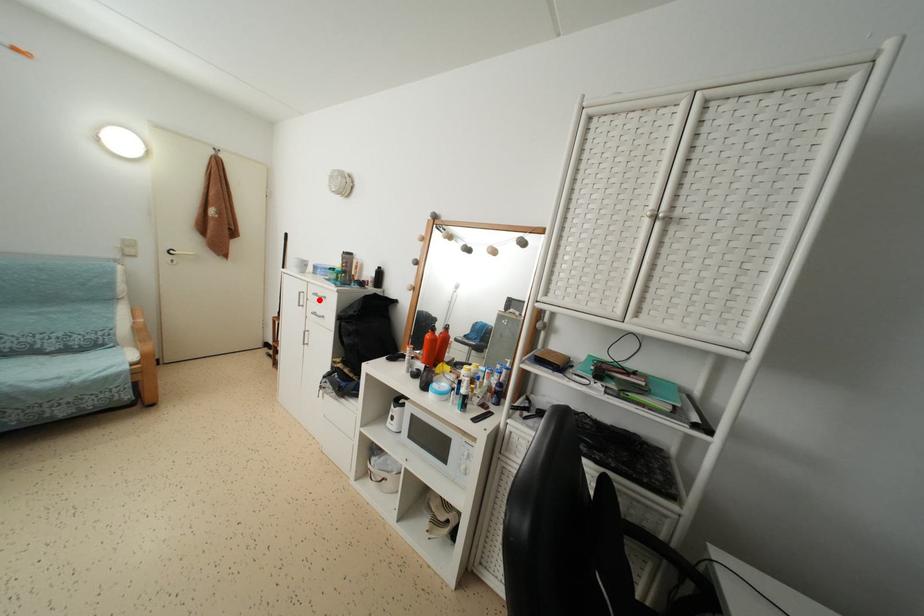
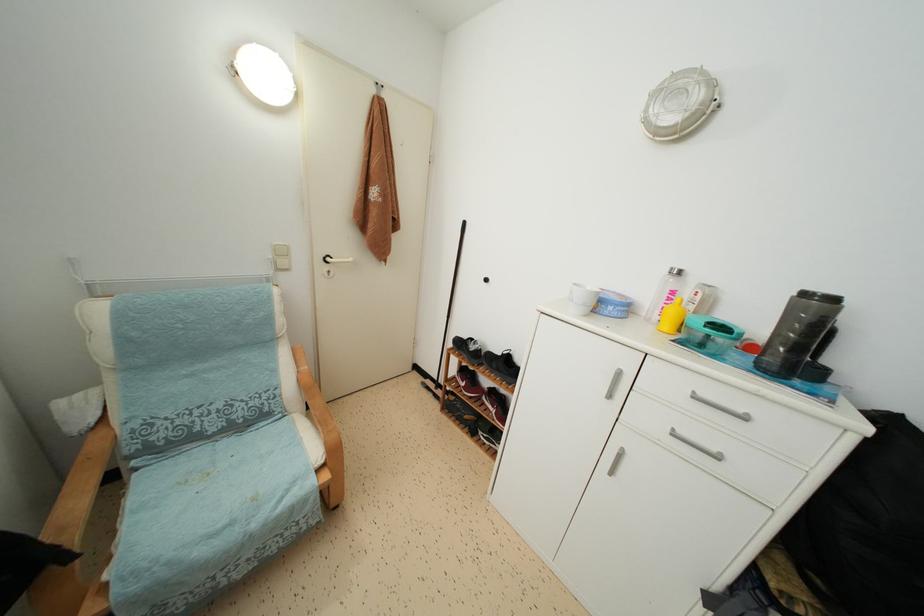
Question: I am providing you with two images of the same scene from different viewpoints. A red point is marked on the first image. Is the red point's position out of view in image 2?

Choices:
 (A) Yes
 (B) No

Answer: (B)